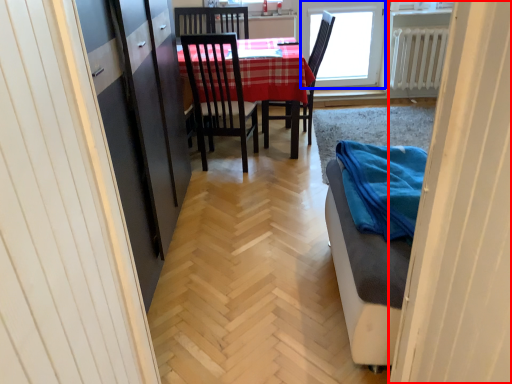
Question: Which object is closer to the camera taking this photo, door (highlighted by a red box) or window (highlighted by a blue box)?

Choices:
 (A) door
 (B) window

Answer: (A)